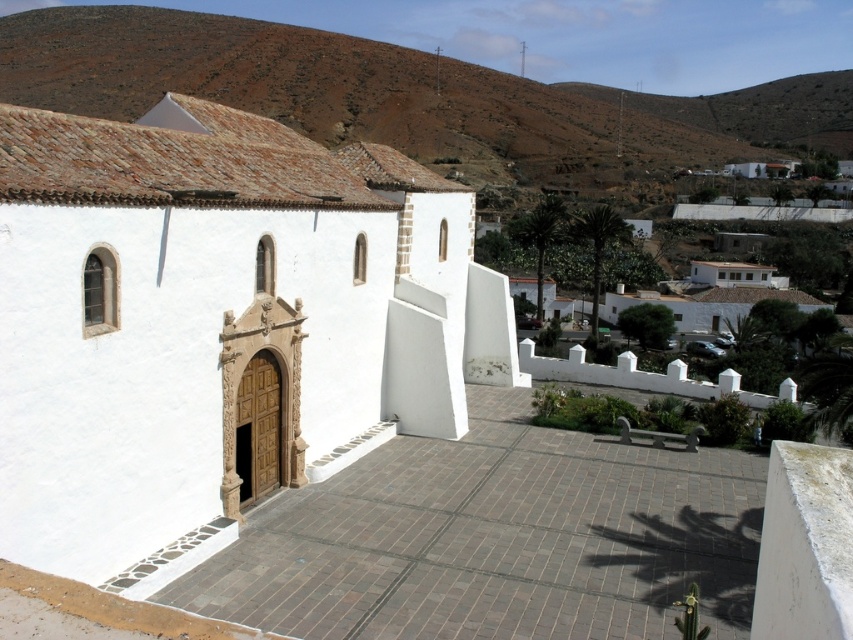
You are standing in the courtyard in front of the white matte church at center. Looking towards the brown clay hillside at upper center, which direction should you walk to reach it?

The white matte church at center is located below the brown clay hillside at upper center, so you should walk upwards or towards the upper part of the scene to reach the brown clay hillside at upper center.

You are standing in the courtyard of the white building with the terracotta roof. There is a point marked at coordinates (216, 326). Based on the scene description, can you determine if this point is located on the building or in the courtyard?

The point at coordinates (216, 326) is on the white matte church at center, so it is located on the building.